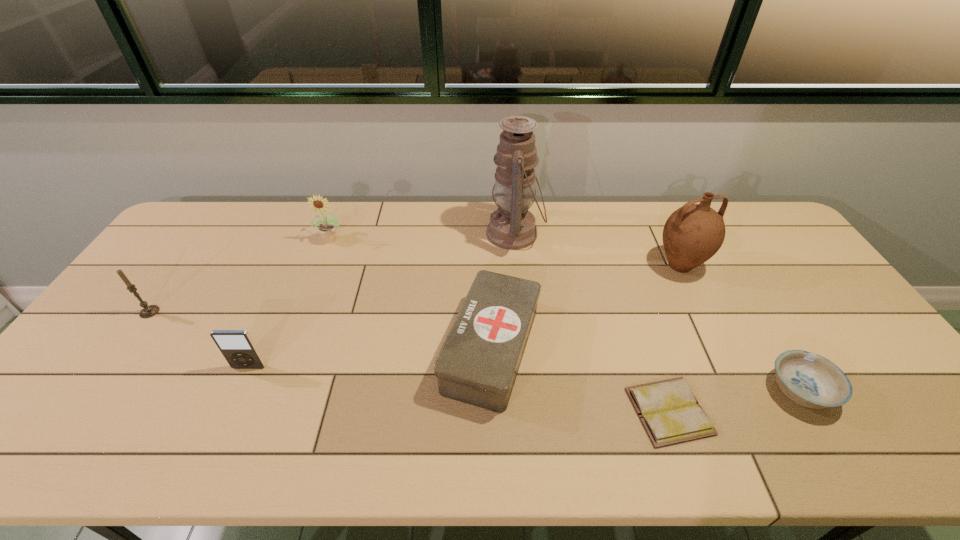
Find the location of a particular element. The image size is (960, 540). object that is at the left edge is located at coordinates (148, 311).

Locate an element on the screen. This screenshot has width=960, height=540. vacant point at the far edge is located at coordinates (612, 215).

In order to click on vacant space at the near edge in this screenshot , I will do `click(233, 451)`.

Find the location of a particular element. Image resolution: width=960 pixels, height=540 pixels. vacant region at the left edge of the desktop is located at coordinates (161, 278).

Locate an element on the screen. The height and width of the screenshot is (540, 960). free spot between the iPod and the seventh tallest object is located at coordinates (525, 379).

This screenshot has width=960, height=540. I want to click on vacant space that's between the seventh shortest object and the sunflower, so click(x=506, y=253).

Identify the location of vacant space that's between the candle and the sunflower. (241, 276).

Locate an element on the screen. This screenshot has height=540, width=960. unoccupied position between the third object from right to left and the second shortest object is located at coordinates (734, 401).

Identify the location of empty space between the oil lamp and the shortest object. This screenshot has width=960, height=540. (592, 322).

The image size is (960, 540). I want to click on free space between the iPod and the bowl, so click(x=525, y=379).